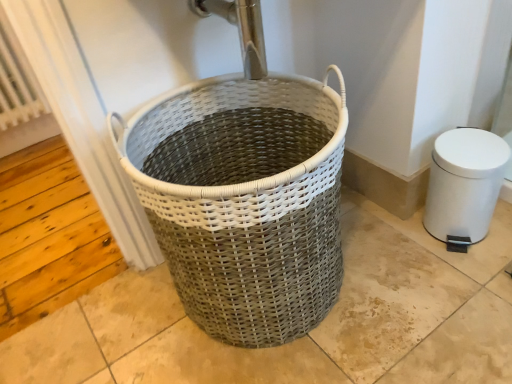
The image size is (512, 384). What are the coordinates of `free space to the left of white plastic bidet at right` in the screenshot? It's located at (393, 248).